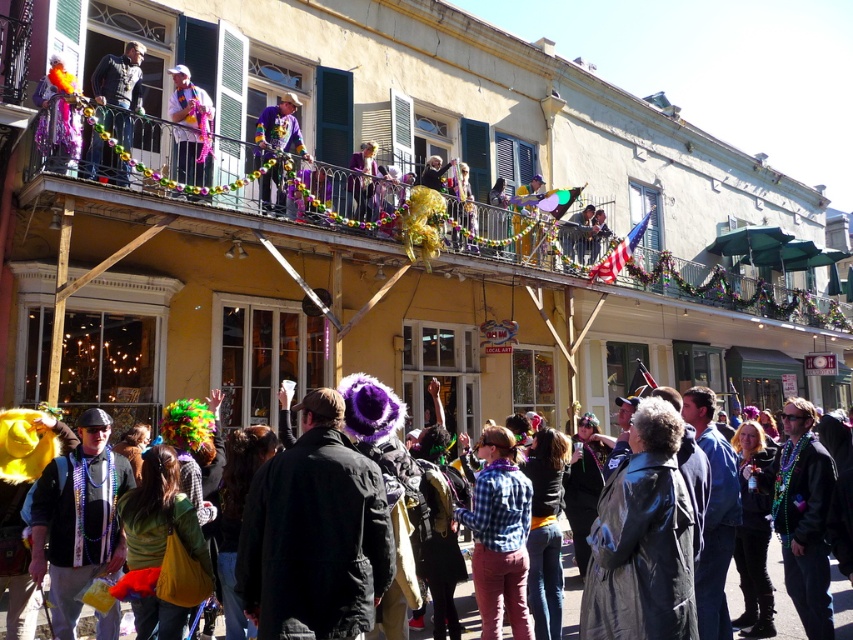
Question: Is matte black jacket at upper left smaller than shiny metallic costume at center?

Choices:
 (A) yes
 (B) no

Answer: (A)

Question: Which object is the closest to the matte black jacket at lower left?

Choices:
 (A) shiny orange feathers at upper left
 (B) matte purple hat at upper center

Answer: (A)

Question: Which point is closer to the camera taking this photo?

Choices:
 (A) (74, 80)
 (B) (791, 624)
 (C) (369, 180)
 (D) (184, 172)

Answer: (B)

Question: Which point is farther from the camera taking this photo?

Choices:
 (A) (372, 173)
 (B) (270, 188)
 (C) (45, 100)

Answer: (A)

Question: Is matte purple hat at upper center below shiny metallic costume at center?

Choices:
 (A) yes
 (B) no

Answer: (A)

Question: Considering the relative positions of matte purple hat at upper center and matte purple coat at upper center in the image provided, where is matte purple hat at upper center located with respect to matte purple coat at upper center?

Choices:
 (A) right
 (B) left

Answer: (B)